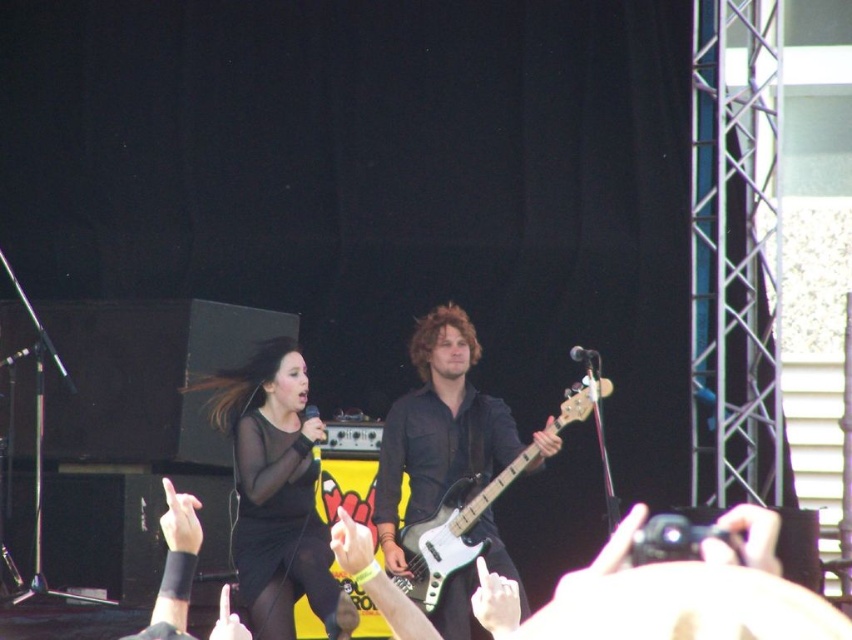
Question: Which point is closer to the camera?

Choices:
 (A) metallic silver bass guitar at center
 (B) black sheer dress at center

Answer: (A)

Question: Is black sheer dress at center positioned at the back of metallic silver bass guitar at center?

Choices:
 (A) no
 (B) yes

Answer: (B)

Question: Is black sheer dress at center above metallic silver bass guitar at center?

Choices:
 (A) yes
 (B) no

Answer: (B)

Question: Is black sheer dress at center above metallic silver bass guitar at center?

Choices:
 (A) no
 (B) yes

Answer: (A)